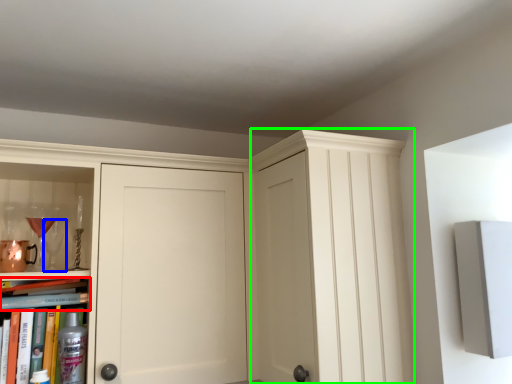
Question: Considering the real-world distances, which object is closest to book (highlighted by a red box)? wine glass (highlighted by a blue box) or glass door (highlighted by a green box).

Choices:
 (A) wine glass
 (B) glass door

Answer: (A)